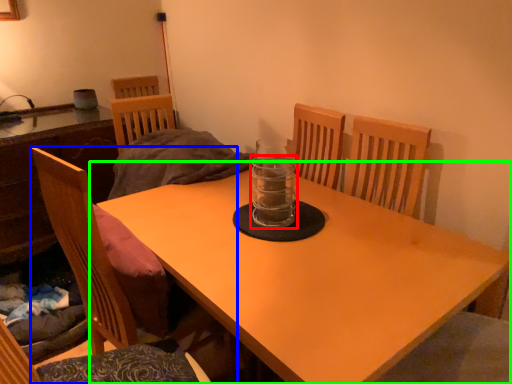
Question: Estimate the real-world distances between objects in this image. Which object is farther from glass jar (highlighted by a red box), chair (highlighted by a blue box) or table (highlighted by a green box)?

Choices:
 (A) chair
 (B) table

Answer: (A)